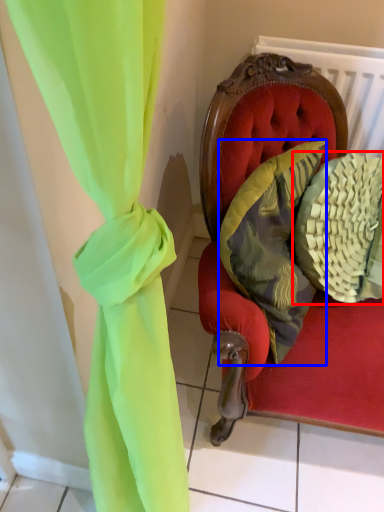
Question: Among these objects, which one is nearest to the camera, pillow (highlighted by a red box) or pillow (highlighted by a blue box)?

Choices:
 (A) pillow
 (B) pillow

Answer: (B)